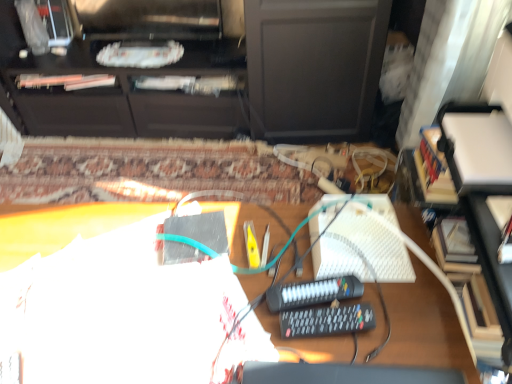
At what (x,y) coordinates should I click in order to perform the action: click on free space to the left of white textured keyboard at center-right. Please return your answer as a coordinate pair (x, y). The width and height of the screenshot is (512, 384). Looking at the image, I should click on (275, 249).